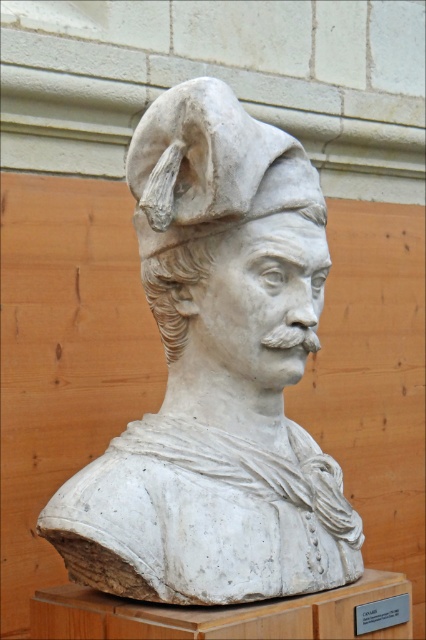
Does white stone bust at center come in front of white marble bust at center?

Yes.

Is point (296, 484) behind point (166, 124)?

That is True.

Where is `white stone bust at center`? The image size is (426, 640). white stone bust at center is located at coordinates (216, 376).